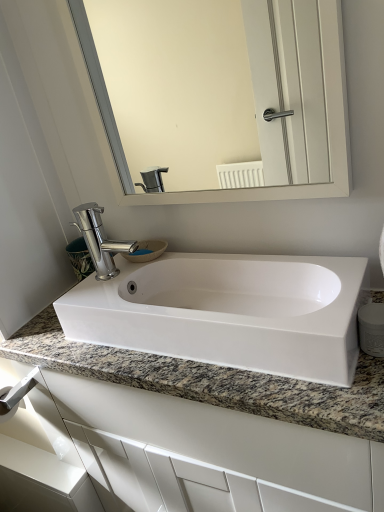
Question: Is polished chrome faucet at center not inside granite at center?

Choices:
 (A) yes
 (B) no

Answer: (A)

Question: Does polished chrome faucet at center have a lesser height compared to granite at center?

Choices:
 (A) no
 (B) yes

Answer: (B)

Question: Does polished chrome faucet at center come in front of granite at center?

Choices:
 (A) no
 (B) yes

Answer: (A)

Question: Is polished chrome faucet at center facing towards granite at center?

Choices:
 (A) yes
 (B) no

Answer: (B)

Question: Can you confirm if polished chrome faucet at center is wider than granite at center?

Choices:
 (A) no
 (B) yes

Answer: (A)

Question: Considering the positions of granite at center and satin nickel towel bar at lower left in the image, is granite at center taller or shorter than satin nickel towel bar at lower left?

Choices:
 (A) short
 (B) tall

Answer: (B)

Question: Looking at their shapes, would you say granite at center is wider or thinner than satin nickel towel bar at lower left?

Choices:
 (A) thin
 (B) wide

Answer: (B)

Question: Choose the correct answer: Is granite at center inside satin nickel towel bar at lower left or outside it?

Choices:
 (A) outside
 (B) inside

Answer: (A)

Question: Does point (117, 382) appear closer or farther from the camera than point (14, 392)?

Choices:
 (A) closer
 (B) farther

Answer: (A)

Question: From the image's perspective, relative to white glossy mirror at upper center, is polished chrome faucet at center above or below?

Choices:
 (A) above
 (B) below

Answer: (B)

Question: From a real-world perspective, is polished chrome faucet at center above or below white glossy mirror at upper center?

Choices:
 (A) above
 (B) below

Answer: (B)

Question: Considering the positions of polished chrome faucet at center and white glossy mirror at upper center in the image, is polished chrome faucet at center bigger or smaller than white glossy mirror at upper center?

Choices:
 (A) big
 (B) small

Answer: (B)

Question: Is polished chrome faucet at center taller or shorter than white glossy mirror at upper center?

Choices:
 (A) tall
 (B) short

Answer: (B)

Question: Is point (97, 203) closer or farther from the camera than point (345, 295)?

Choices:
 (A) closer
 (B) farther

Answer: (B)

Question: Considering the positions of polished chrome faucet at center and white glossy sink at center in the image, is polished chrome faucet at center wider or thinner than white glossy sink at center?

Choices:
 (A) wide
 (B) thin

Answer: (B)